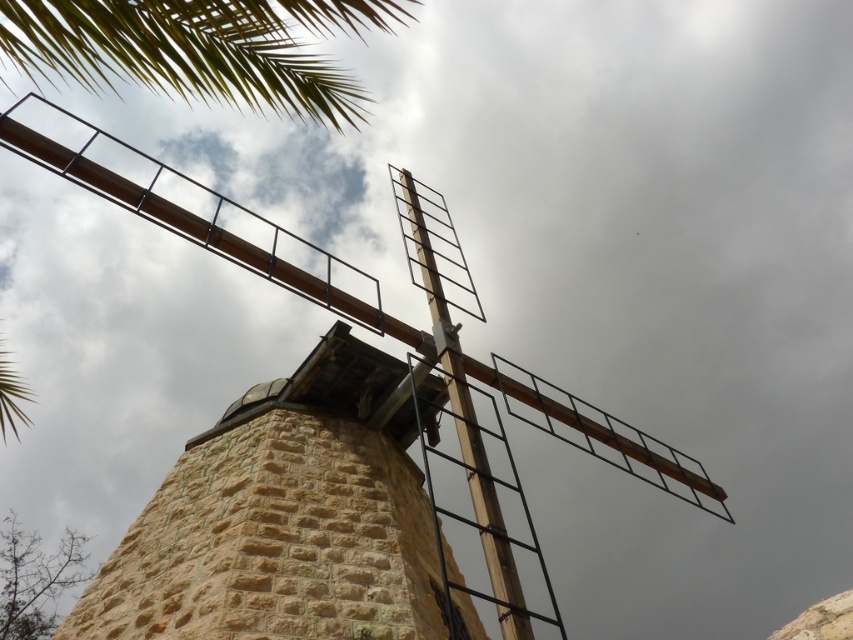
You are standing at the base of the windmill and looking up. Which object, the stone textured tower at center or the green leafy palm at upper left, is closer to your eyes?

The stone textured tower at center is closer to your eyes because the green leafy palm at upper left is behind it.

You are standing at the base of the wooden windmill at center and want to place a small garden ornament between it and the green leafy palm at upper left. Based on their widths, will the ornament fit in the space between them?

The wooden windmill at center might be wider than green leafy palm at upper left, so there may not be enough space for the ornament between them. Check the actual width before placing it.

You are standing on the ground looking up at the wooden windmill at center and the green leafy palm at upper left. Which object is closer to you?

The wooden windmill at center is closer to you because it is further to the viewer than the green leafy palm at upper left, meaning it appears nearer in the visual perspective.